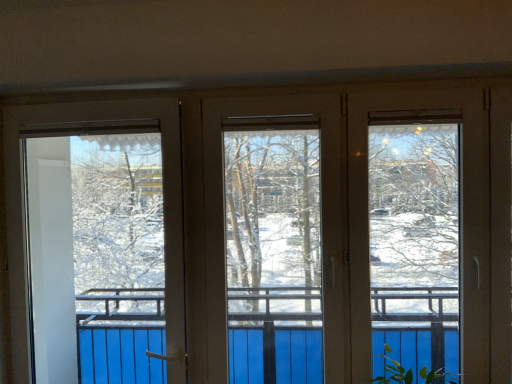
What is the approximate height of transparent plastic screen door at left?

It is 4.22 feet.

You are a GUI agent. You are given a task and a screenshot of the screen. Output one action in this format:
    pyautogui.click(x=<x>, y=<y>)
    Task: Click on the transparent plastic screen door at left
    The image size is (512, 384).
    Given the screenshot: What is the action you would take?
    pyautogui.click(x=97, y=258)

What do you see at coordinates (97, 258) in the screenshot? I see `transparent plastic screen door at left` at bounding box center [97, 258].

The height and width of the screenshot is (384, 512). I want to click on green leafy plant at lower right, so click(393, 371).

Describe the element at coordinates (393, 371) in the screenshot. I see `green leafy plant at lower right` at that location.

At what (x,y) coordinates should I click in order to perform the action: click on transparent plastic screen door at left. Please return your answer as a coordinate pair (x, y). Image resolution: width=512 pixels, height=384 pixels. Looking at the image, I should click on (97, 258).

Does transparent plastic screen door at left appear on the left side of green leafy plant at lower right?

Yes.

Is transparent plastic screen door at left behind green leafy plant at lower right?

Yes, transparent plastic screen door at left is behind green leafy plant at lower right.

Between point (79, 259) and point (395, 372), which one is positioned behind?

The point (79, 259) is farther from the camera.

Based on the photo, from the image's perspective, is transparent plastic screen door at left on top of green leafy plant at lower right?

Yes.

From a real-world perspective, who is located lower, transparent plastic screen door at left or green leafy plant at lower right?

green leafy plant at lower right.

Between transparent plastic screen door at left and green leafy plant at lower right, which one has smaller width?

With smaller width is transparent plastic screen door at left.

From their relative heights in the image, would you say transparent plastic screen door at left is taller or shorter than green leafy plant at lower right?

In the image, transparent plastic screen door at left appears to be taller than green leafy plant at lower right.

Is transparent plastic screen door at left bigger than green leafy plant at lower right?

No.

Is transparent plastic screen door at left situated inside green leafy plant at lower right or outside?

transparent plastic screen door at left is located beyond the bounds of green leafy plant at lower right.

Is transparent plastic screen door at left touching green leafy plant at lower right?

No, transparent plastic screen door at left is not beside green leafy plant at lower right.

Is transparent plastic screen door at left looking in the opposite direction of green leafy plant at lower right?

No, green leafy plant at lower right is not at the back of transparent plastic screen door at left.

In the scene shown: How far apart are transparent plastic screen door at left and green leafy plant at lower right?

transparent plastic screen door at left is 6.79 feet from green leafy plant at lower right.

The width and height of the screenshot is (512, 384). Find the location of `plant that is on the right side of transparent plastic screen door at left`. plant that is on the right side of transparent plastic screen door at left is located at coordinates (393, 371).

Can you confirm if green leafy plant at lower right is positioned to the right of transparent plastic screen door at left?

Yes, green leafy plant at lower right is to the right of transparent plastic screen door at left.

Is green leafy plant at lower right further to the viewer compared to transparent plastic screen door at left?

That is False.

Is point (389, 348) closer or farther from the camera than point (128, 291)?

Point (389, 348) appears to be closer to the viewer than point (128, 291).

From the image's perspective, which is above, green leafy plant at lower right or transparent plastic screen door at left?

transparent plastic screen door at left, from the image's perspective.

From a real-world perspective, who is located lower, green leafy plant at lower right or transparent plastic screen door at left?

From a 3D spatial view, green leafy plant at lower right is below.

Which of these two, green leafy plant at lower right or transparent plastic screen door at left, is thinner?

With smaller width is transparent plastic screen door at left.

Which of these two, green leafy plant at lower right or transparent plastic screen door at left, stands taller?

With more height is transparent plastic screen door at left.

Does green leafy plant at lower right have a smaller size compared to transparent plastic screen door at left?

Incorrect, green leafy plant at lower right is not smaller in size than transparent plastic screen door at left.

Choose the correct answer: Is green leafy plant at lower right inside transparent plastic screen door at left or outside it?

green leafy plant at lower right exists outside the volume of transparent plastic screen door at left.

Would you say green leafy plant at lower right is a long distance from transparent plastic screen door at left?

Yes.

Is transparent plastic screen door at left at the back of green leafy plant at lower right?

No, green leafy plant at lower right is not facing the opposite direction of transparent plastic screen door at left.

How different are the orientations of green leafy plant at lower right and transparent plastic screen door at left in degrees?

They differ by 1.6 degrees in their facing directions.

Locate an element on the screen. screen door above the green leafy plant at lower right (from a real-world perspective) is located at coordinates (97, 258).

The height and width of the screenshot is (384, 512). I want to click on plant lying on the right of transparent plastic screen door at left, so click(393, 371).

The image size is (512, 384). I want to click on plant in front of the transparent plastic screen door at left, so point(393,371).